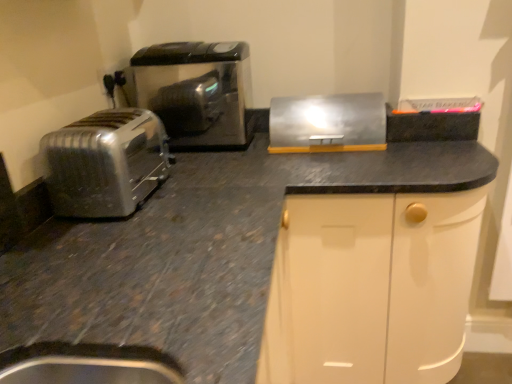
Question: From a real-world perspective, is satin silver toaster at left physically below satin black toaster at left?

Choices:
 (A) yes
 (B) no

Answer: (A)

Question: Is satin silver toaster at left oriented towards satin black toaster at left?

Choices:
 (A) no
 (B) yes

Answer: (A)

Question: From the image's perspective, is satin silver toaster at left above satin black toaster at left?

Choices:
 (A) no
 (B) yes

Answer: (A)

Question: Does satin silver toaster at left have a lesser height compared to satin black toaster at left?

Choices:
 (A) no
 (B) yes

Answer: (B)

Question: Can you confirm if satin silver toaster at left is taller than satin black toaster at left?

Choices:
 (A) yes
 (B) no

Answer: (B)

Question: Is satin silver toaster at left oriented away from satin black toaster at left?

Choices:
 (A) yes
 (B) no

Answer: (B)

Question: Can you confirm if matte black outlet at upper left is positioned to the right of metallic silver breadbox at upper right?

Choices:
 (A) yes
 (B) no

Answer: (B)

Question: From the image's perspective, is matte black outlet at upper left located above metallic silver breadbox at upper right?

Choices:
 (A) yes
 (B) no

Answer: (A)

Question: Is matte black outlet at upper left positioned beyond the bounds of metallic silver breadbox at upper right?

Choices:
 (A) no
 (B) yes

Answer: (B)

Question: Is the position of matte black outlet at upper left less distant than that of metallic silver breadbox at upper right?

Choices:
 (A) yes
 (B) no

Answer: (B)

Question: Considering the relative sizes of matte black outlet at upper left and metallic silver breadbox at upper right in the image provided, is matte black outlet at upper left smaller than metallic silver breadbox at upper right?

Choices:
 (A) yes
 (B) no

Answer: (A)

Question: Is matte black outlet at upper left oriented towards metallic silver breadbox at upper right?

Choices:
 (A) no
 (B) yes

Answer: (B)

Question: From the image's perspective, does satin silver toaster at left appear lower than metallic silver breadbox at upper right?

Choices:
 (A) no
 (B) yes

Answer: (B)